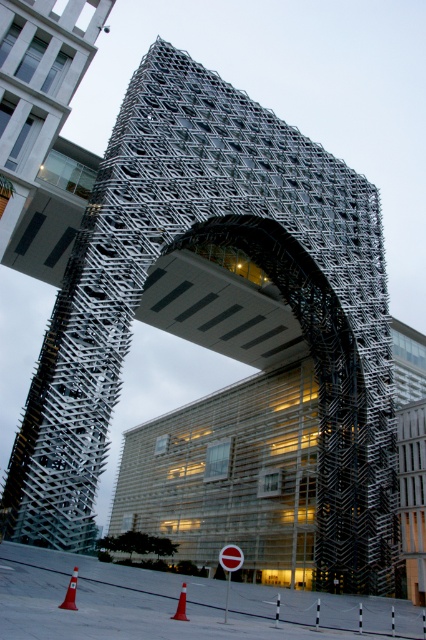
Does red matte stop sign at center have a lesser width compared to orange plastic cone at lower center?

In fact, red matte stop sign at center might be wider than orange plastic cone at lower center.

What do you see at coordinates (230, 557) in the screenshot?
I see `red matte stop sign at center` at bounding box center [230, 557].

At what (x,y) coordinates should I click in order to perform the action: click on red matte stop sign at center. Please return your answer as a coordinate pair (x, y). The width and height of the screenshot is (426, 640). Looking at the image, I should click on (230, 557).

Is point (230, 545) less distant than point (66, 593)?

That is False.

Where is `red matte stop sign at center`? Image resolution: width=426 pixels, height=640 pixels. red matte stop sign at center is located at coordinates (230, 557).

Which is in front, point (229, 550) or point (71, 580)?

Positioned in front is point (71, 580).

Find the location of `red matte stop sign at center`. red matte stop sign at center is located at coordinates (230, 557).

Who is lower down, orange plastic cone at lower left or orange plastic cone at lower center?

orange plastic cone at lower center is below.

Is orange plastic cone at lower left to the left of orange plastic cone at lower center from the viewer's perspective?

Indeed, orange plastic cone at lower left is positioned on the left side of orange plastic cone at lower center.

Measure the distance between orange plastic cone at lower left and camera.

The distance of orange plastic cone at lower left from camera is 70.26 feet.

The width and height of the screenshot is (426, 640). Identify the location of orange plastic cone at lower left. (71, 593).